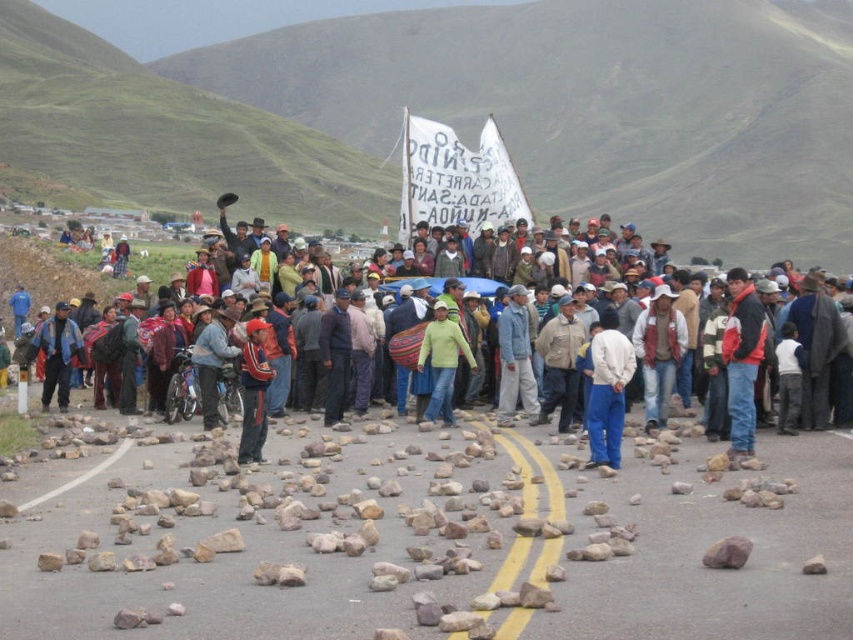
Question: Which point is farther to the camera?

Choices:
 (A) light green sweater at center
 (B) white cotton shirt at center
 (C) red fabric backpack at center

Answer: (B)

Question: Which of the following is the closest to the observer?

Choices:
 (A) (16, 211)
 (B) (602, 396)
 (C) (727, 340)

Answer: (B)

Question: Is white cotton shirt at center positioned in front of red fabric backpack at center?

Choices:
 (A) no
 (B) yes

Answer: (A)

Question: Is red jacket at center smaller than light green sweater at center?

Choices:
 (A) no
 (B) yes

Answer: (A)

Question: Which point appears farthest from the camera in this image?

Choices:
 (A) (22, 234)
 (B) (660, 332)
 (C) (735, 268)

Answer: (A)

Question: Can you confirm if white matte pants at center is positioned to the left of red fabric backpack at center?

Choices:
 (A) yes
 (B) no

Answer: (B)